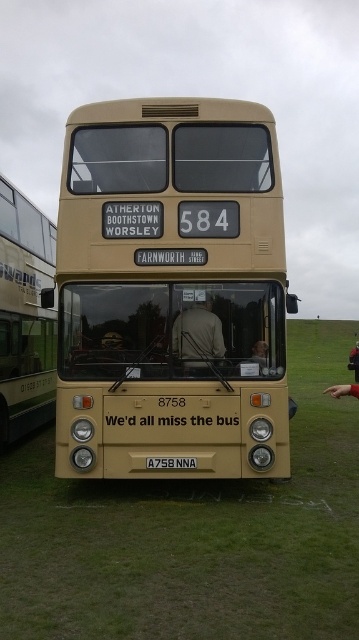
Does matte gold bus at center have a greater height compared to green grass at center?

Yes.

Is matte gold bus at center closer to the viewer compared to green grass at center?

No, it is behind green grass at center.

The width and height of the screenshot is (359, 640). I want to click on matte gold bus at center, so click(170, 289).

Is point (224, 257) less distant than point (194, 348)?

Yes, it is.

Who is higher up, matte gold bus at center or light brown leather jacket at center?

light brown leather jacket at center

Who is more forward, (266, 168) or (189, 355)?

Point (189, 355)

Locate an element on the screen. matte gold bus at center is located at coordinates [x=170, y=289].

Can you confirm if matte gold bus at center is bigger than black plastic license plate at center?

Correct, matte gold bus at center is larger in size than black plastic license plate at center.

Can you confirm if matte gold bus at center is thinner than black plastic license plate at center?

In fact, matte gold bus at center might be wider than black plastic license plate at center.

Is point (267, 204) farther from viewer compared to point (193, 468)?

Yes, it is behind point (193, 468).

Locate an element on the screen. matte gold bus at center is located at coordinates (170, 289).